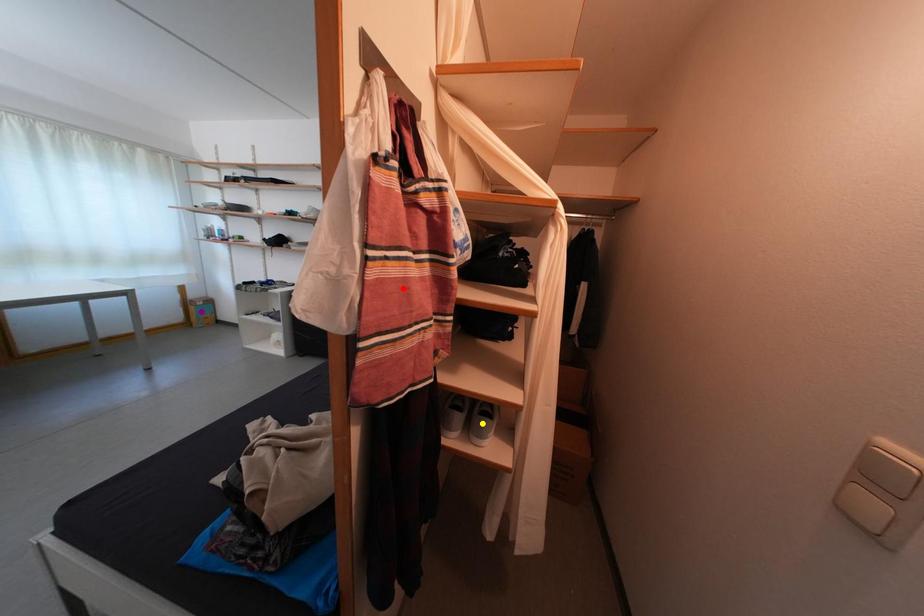
Order these from nearest to farthest:
purple point | red point | yellow point

A: 1. purple point
2. yellow point
3. red point